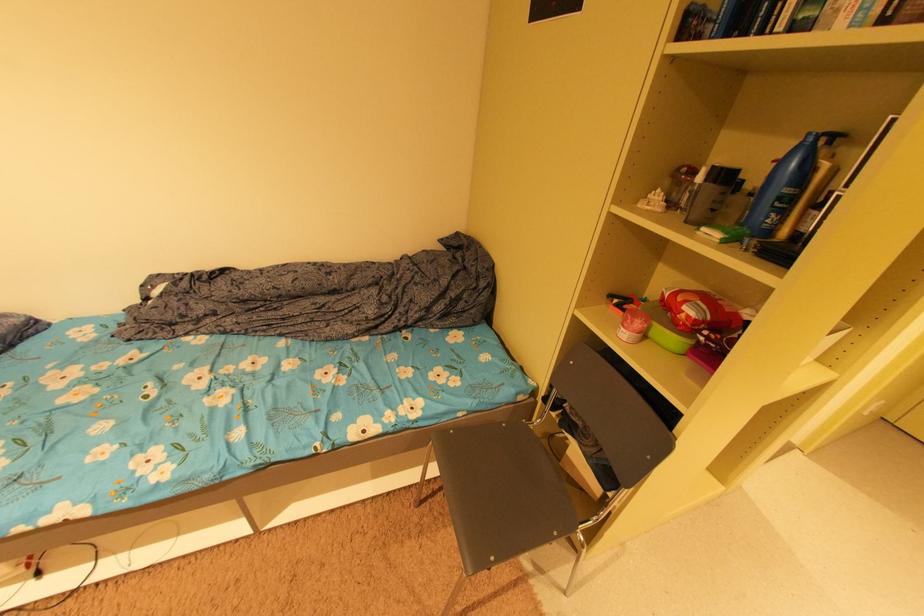
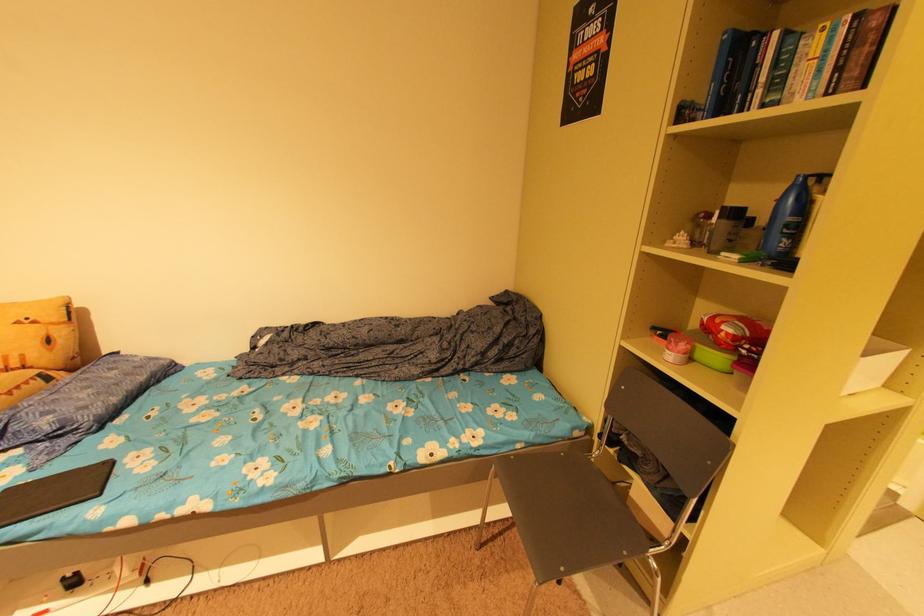
Find the pixel in the second image that matches [563,533] in the first image.

(633, 554)